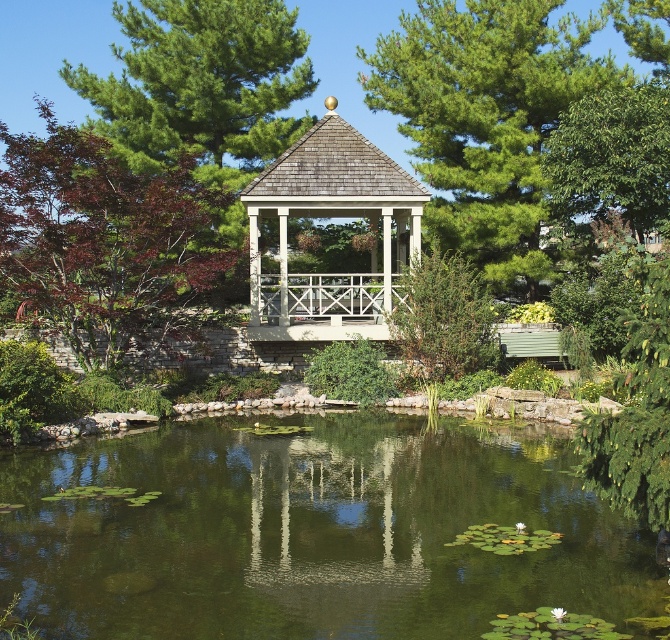
Who is taller, green pine tree at upper center or green textured pine tree at upper left?

green pine tree at upper center

You are a GUI agent. You are given a task and a screenshot of the screen. Output one action in this format:
    pyautogui.click(x=<x>, y=<y>)
    Task: Click on the green pine tree at upper center
    This screenshot has width=670, height=640.
    Given the screenshot: What is the action you would take?
    pyautogui.click(x=484, y=116)

Can you confirm if green reflective water at center is thinner than green textured pine tree at upper left?

Correct, green reflective water at center's width is less than green textured pine tree at upper left's.

Locate an element on the screen. The image size is (670, 640). green reflective water at center is located at coordinates (312, 531).

The height and width of the screenshot is (640, 670). I want to click on green reflective water at center, so click(x=312, y=531).

Identify the location of green reflective water at center. This screenshot has height=640, width=670. (312, 531).

Who is higher up, green pine tree at upper center or green leafy tree at upper right?

green pine tree at upper center is above.

Between point (458, 205) and point (616, 204), which one is positioned in front?

Point (616, 204) is in front.

The height and width of the screenshot is (640, 670). What do you see at coordinates (484, 116) in the screenshot?
I see `green pine tree at upper center` at bounding box center [484, 116].

Find the location of `green pine tree at upper center`. green pine tree at upper center is located at coordinates (484, 116).